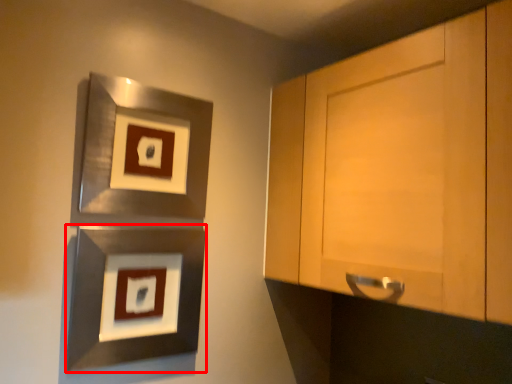
Question: Where is picture frame (annotated by the red box) located in relation to picture frame in the image?

Choices:
 (A) left
 (B) right

Answer: (A)